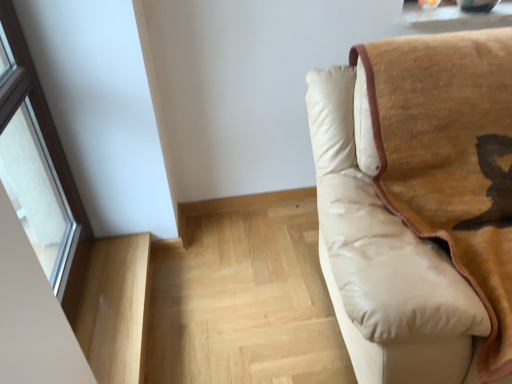
Question: Is light wood stairwell at lower left, the 1th stairwell positioned from the right, at the back of light wood stairwell at lower left, the 2th stairwell viewed from the right?

Choices:
 (A) yes
 (B) no

Answer: (B)

Question: Does light wood stairwell at lower left, acting as the first stairwell starting from the left, have a larger size compared to light wood stairwell at lower left, which ranks as the 2th stairwell in left-to-right order?

Choices:
 (A) yes
 (B) no

Answer: (B)

Question: Can you confirm if light wood stairwell at lower left, the 2th stairwell viewed from the right, is thinner than light wood stairwell at lower left, the 1th stairwell positioned from the right?

Choices:
 (A) no
 (B) yes

Answer: (B)

Question: Is light wood stairwell at lower left, the 2th stairwell viewed from the right, oriented towards light wood stairwell at lower left, which ranks as the 2th stairwell in left-to-right order?

Choices:
 (A) no
 (B) yes

Answer: (A)

Question: Is light wood stairwell at lower left, the 2th stairwell viewed from the right, further to the viewer compared to light wood stairwell at lower left, which ranks as the 2th stairwell in left-to-right order?

Choices:
 (A) no
 (B) yes

Answer: (A)

Question: Considering the relative sizes of light wood stairwell at lower left, acting as the first stairwell starting from the left, and light wood stairwell at lower left, the 1th stairwell positioned from the right, in the image provided, is light wood stairwell at lower left, acting as the first stairwell starting from the left, taller than light wood stairwell at lower left, the 1th stairwell positioned from the right,?

Choices:
 (A) yes
 (B) no

Answer: (A)

Question: Is light wood stairwell at lower left, acting as the first stairwell starting from the left, directly adjacent to transparent glass window at left?

Choices:
 (A) yes
 (B) no

Answer: (B)

Question: Is transparent glass window at left at the back of light wood stairwell at lower left, the 2th stairwell viewed from the right?

Choices:
 (A) yes
 (B) no

Answer: (B)

Question: From a real-world perspective, is light wood stairwell at lower left, acting as the first stairwell starting from the left, positioned over transparent glass window at left based on gravity?

Choices:
 (A) no
 (B) yes

Answer: (A)

Question: Can you confirm if light wood stairwell at lower left, the 2th stairwell viewed from the right, is positioned to the left of transparent glass window at left?

Choices:
 (A) no
 (B) yes

Answer: (A)

Question: Can you confirm if light wood stairwell at lower left, acting as the first stairwell starting from the left, is taller than transparent glass window at left?

Choices:
 (A) yes
 (B) no

Answer: (B)

Question: Can you confirm if light wood stairwell at lower left, the 2th stairwell viewed from the right, is wider than beige leather couch at right?

Choices:
 (A) yes
 (B) no

Answer: (B)